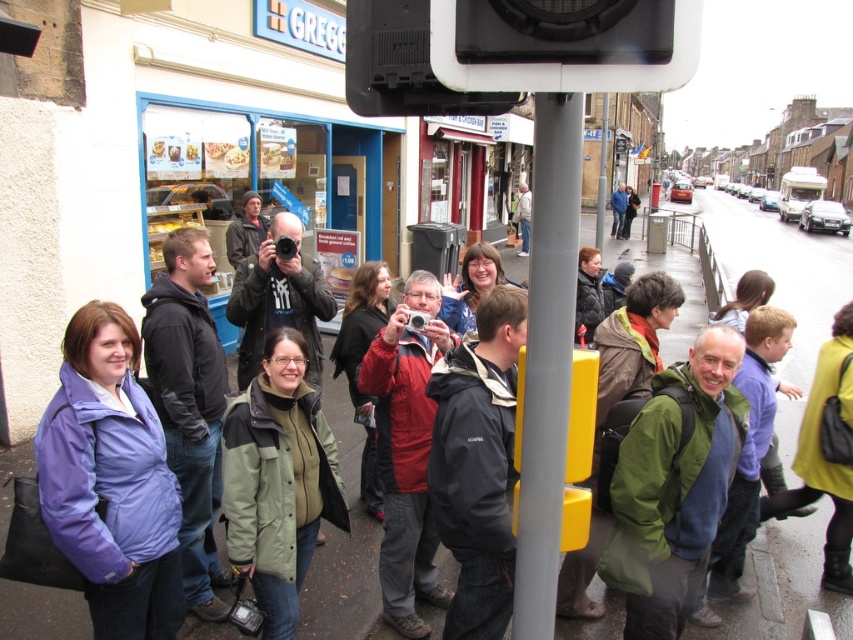
You are a photographer standing at the edge of the crowd near the traffic light pole. You need to take a photo of the light brown leather jacket at center without the purple fabric jacket at lower left blocking the view. Is this possible given their positions?

The purple fabric jacket at lower left is closer to the viewer than the light brown leather jacket at center, so it would block the view. Move closer to the light brown leather jacket at center to avoid obstruction.

From the picture: You are a photographer standing in the town center near the Greggs bakery. You notice two people wearing a dark gray hoodie at center and a red matte jacket at center. Which person is standing closer to the photographer?

The dark gray hoodie at center is above the red matte jacket at center, so the person wearing the dark gray hoodie at center is standing closer to the photographer.